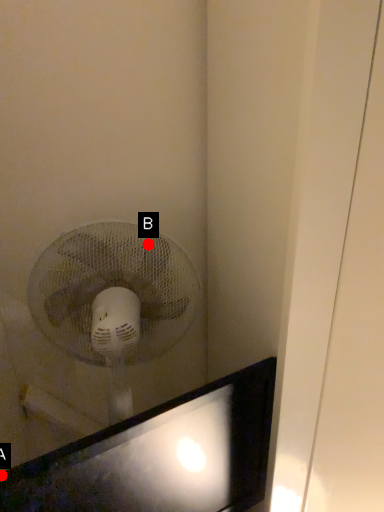
Question: Two points are circled on the image, labeled by A and B beside each circle. Which point is closer to the camera taking this photo?

Choices:
 (A) A is closer
 (B) B is closer

Answer: (A)